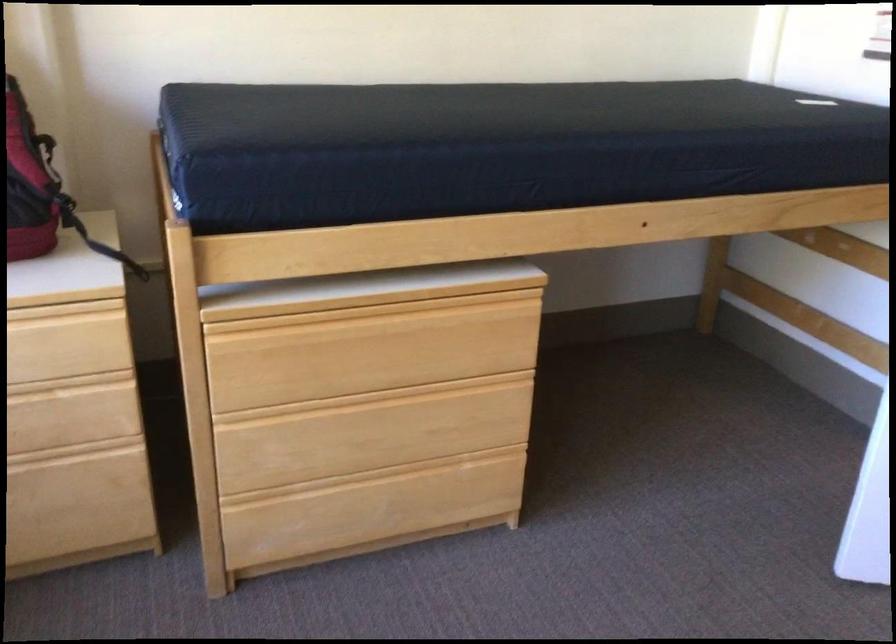
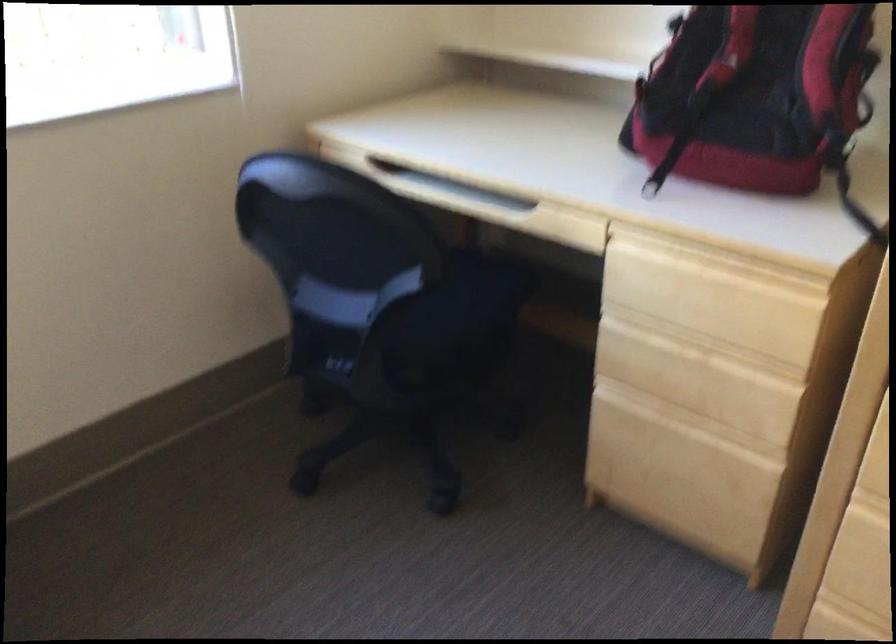
Question: The camera is either moving clockwise (left) or counter-clockwise (right) around the object. The first image is from the beginning of the video and the second image is from the end. Is the camera moving left or right when shooting the video?

Choices:
 (A) Left
 (B) Right

Answer: (B)